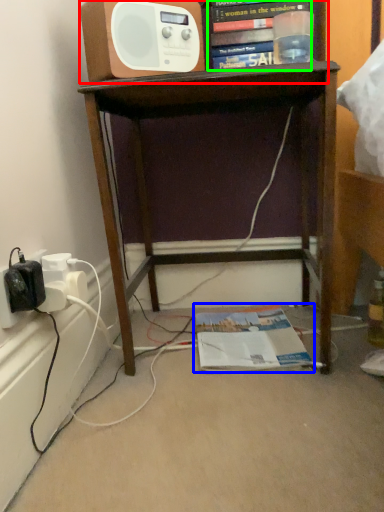
Question: Which object is the farthest from shelf (highlighted by a red box)? Choose among these: magazine (highlighted by a blue box) or book (highlighted by a green box).

Choices:
 (A) magazine
 (B) book

Answer: (A)